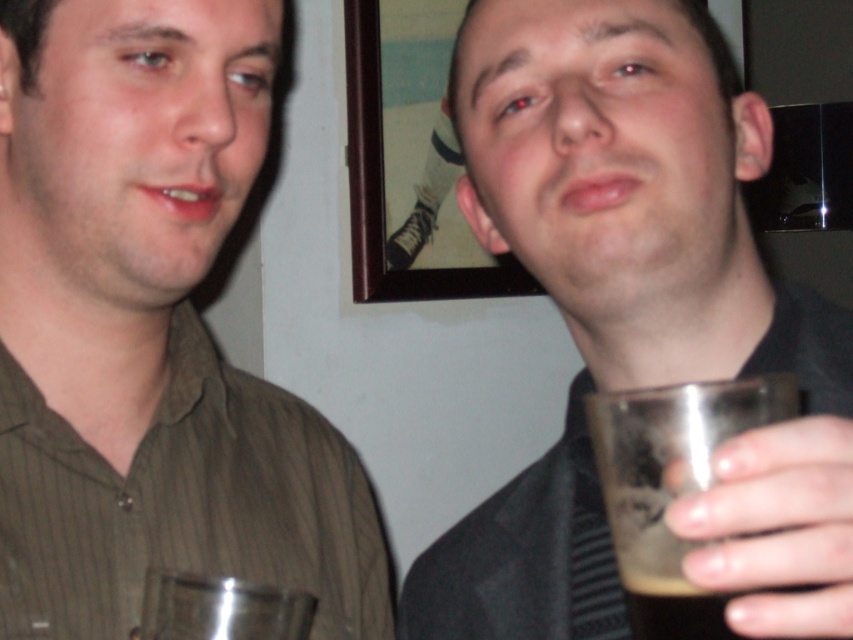
You are a photographer setting up a shot of the matte brown shirt at left and the translucent glass at right. You need to ensure that the subject with the wider width is centered in the frame. Which object should you center?

The matte brown shirt at left should be centered because its width is greater than the translucent glass at right.

You are a bartender preparing drinks for two customers. You have a clear plastic cup at upper right and a translucent glass at right. Which drink container should you place closer to the customers to ensure they can easily reach it without obstructing the other?

The clear plastic cup at upper right should be placed closer to the customers since it is in front of the translucent glass at right, allowing easy access without blocking the other container.

You are a bartender who needs to reach the clear plastic cup at upper right. You are standing 10 inches away from it. Can you grab it without moving your feet?

The clear plastic cup at upper right is 11.82 inches away from the camera, so if you are standing 10 inches away from it, you can extend your arm to grab it since the remaining distance is 1.82 inches.